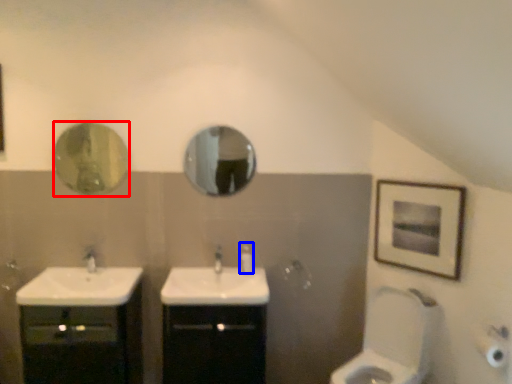
Question: Which point is further to the camera, mirror (highlighted by a red box) or soap dispenser (highlighted by a blue box)?

Choices:
 (A) mirror
 (B) soap dispenser

Answer: (B)